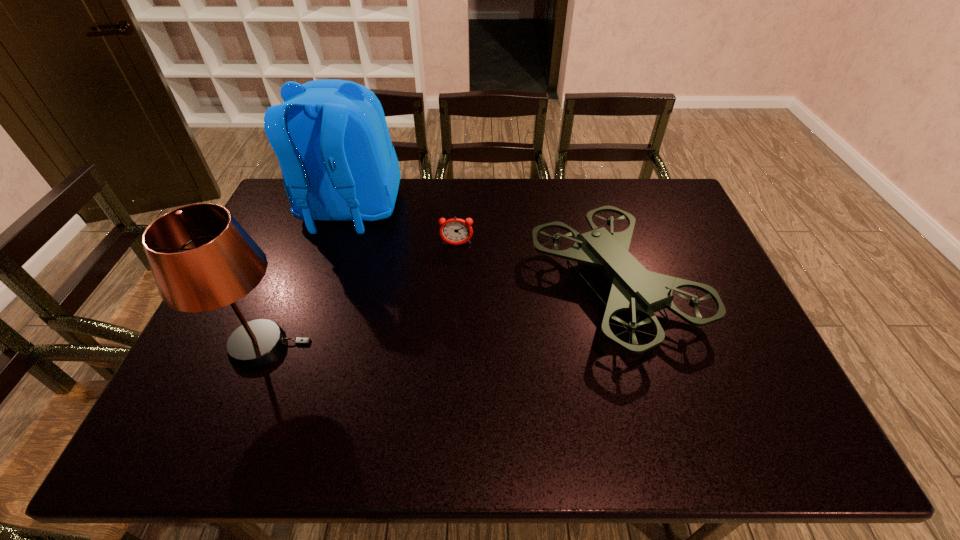
What are the coordinates of `object that ranks as the third closest to the alarm clock` in the screenshot? It's located at (201, 258).

This screenshot has width=960, height=540. I want to click on free location that satisfies the following two spatial constraints: 1. on the front-facing side of the shortest object; 2. on the front-facing side of the lampshade, so click(451, 346).

Identify the location of vacant space that satisfies the following two spatial constraints: 1. on the back of the backpack; 2. on the front-facing side of the lampshade. (304, 346).

Where is `free location that satisfies the following two spatial constraints: 1. on the front-facing side of the rightmost object; 2. on the left side of the alarm clock`? free location that satisfies the following two spatial constraints: 1. on the front-facing side of the rightmost object; 2. on the left side of the alarm clock is located at coordinates (454, 288).

Locate an element on the screen. Image resolution: width=960 pixels, height=540 pixels. vacant region that satisfies the following two spatial constraints: 1. on the back of the backpack; 2. on the left side of the rightmost object is located at coordinates (324, 288).

The image size is (960, 540). I want to click on vacant region that satisfies the following two spatial constraints: 1. on the front-facing side of the shortest object; 2. on the front-facing side of the lampshade, so click(x=451, y=346).

Locate an element on the screen. The height and width of the screenshot is (540, 960). vacant space that satisfies the following two spatial constraints: 1. on the back of the drone; 2. on the left side of the backpack is located at coordinates (324, 288).

Where is `free location that satisfies the following two spatial constraints: 1. on the back of the backpack; 2. on the front-facing side of the lampshade`? free location that satisfies the following two spatial constraints: 1. on the back of the backpack; 2. on the front-facing side of the lampshade is located at coordinates click(304, 346).

Where is `free spot that satisfies the following two spatial constraints: 1. on the back of the backpack; 2. on the left side of the third tallest object`? This screenshot has width=960, height=540. free spot that satisfies the following two spatial constraints: 1. on the back of the backpack; 2. on the left side of the third tallest object is located at coordinates (324, 288).